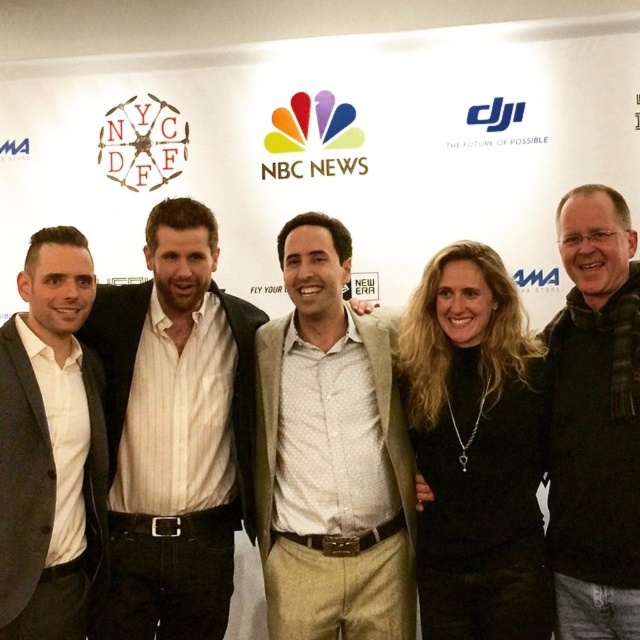
Question: Which point appears closest to the camera in this image?

Choices:
 (A) (336, 604)
 (B) (483, 339)
 (C) (602, 476)
 (D) (3, 636)

Answer: (D)

Question: Can you confirm if white striped shirt at center is wider than white matte suit at left?

Choices:
 (A) no
 (B) yes

Answer: (B)

Question: Is white striped shirt at center below light beige textured blazer at center?

Choices:
 (A) no
 (B) yes

Answer: (A)

Question: Which point is closer to the camera taking this photo?

Choices:
 (A) (593, 262)
 (B) (502, 449)

Answer: (B)

Question: Is black wool sweater at right smaller than white matte suit at left?

Choices:
 (A) yes
 (B) no

Answer: (B)

Question: Which is farther from the white striped shirt at center?

Choices:
 (A) light beige textured blazer at center
 (B) black matte dress at center

Answer: (B)